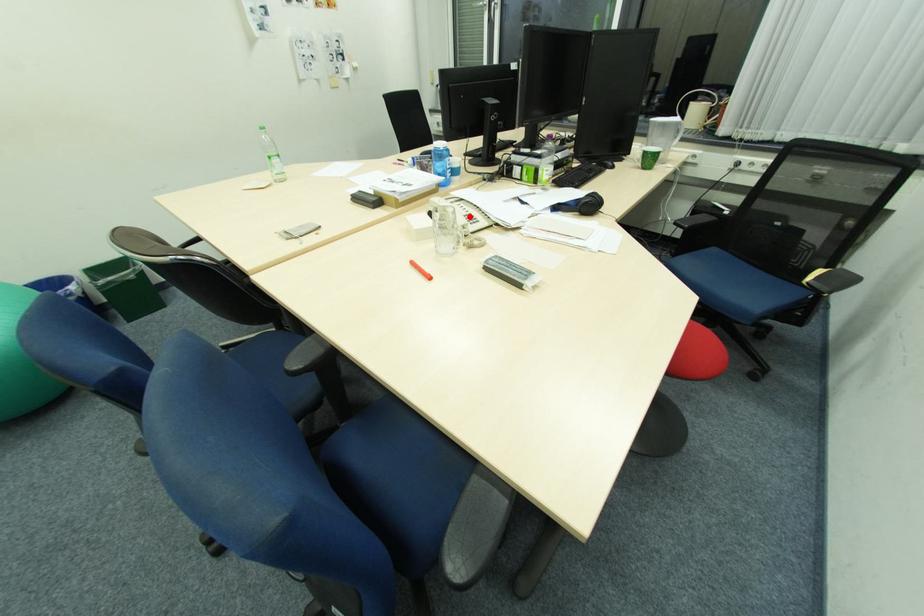
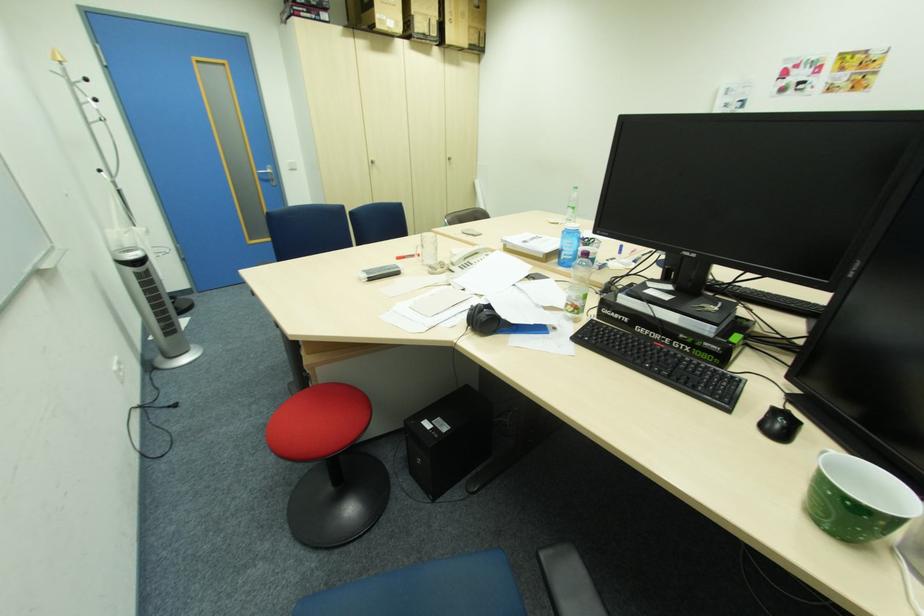
Where in the second image is the point corresponding to the highlighted location from the first image?

(475, 262)